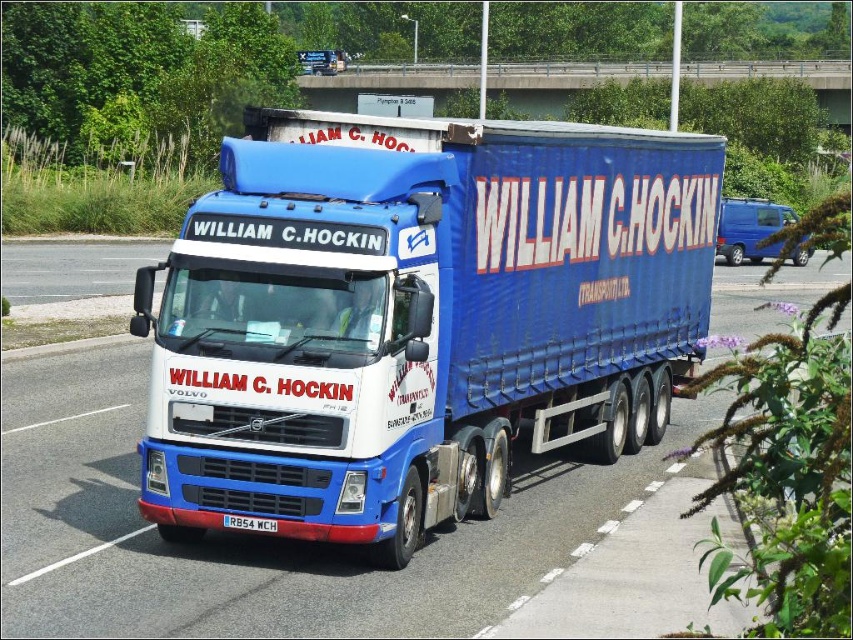
The image size is (853, 640). I want to click on blue fabric trailer truck at center, so click(416, 317).

Between blue fabric trailer truck at center and brushed metal bridge at upper center, which one has less height?

blue fabric trailer truck at center is shorter.

Is blue fabric trailer truck at center further to the viewer compared to brushed metal bridge at upper center?

That is False.

Describe the element at coordinates (416, 317) in the screenshot. I see `blue fabric trailer truck at center` at that location.

Locate an element on the screen. The image size is (853, 640). blue fabric trailer truck at center is located at coordinates (416, 317).

Is white glossy truck at center positioned in front of white plastic license plate at center?

Yes, white glossy truck at center is in front of white plastic license plate at center.

Measure the distance between white glossy truck at center and camera.

A distance of 7.00 meters exists between white glossy truck at center and camera.

Image resolution: width=853 pixels, height=640 pixels. I want to click on white glossy truck at center, so click(x=254, y=536).